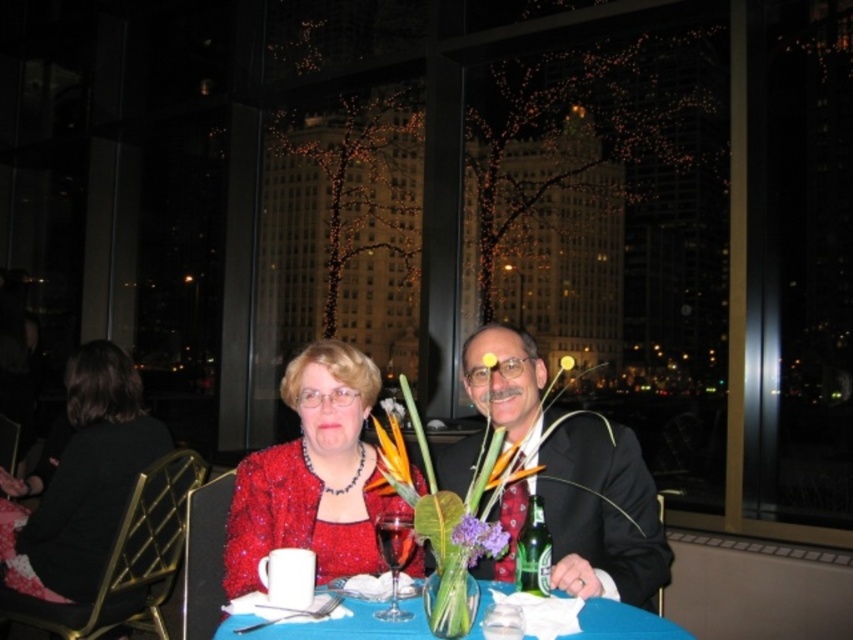
The image size is (853, 640). In order to click on transparent glass wine glass at center in this screenshot , I will do `click(393, 556)`.

Is transparent glass wine glass at center further to the viewer compared to purple matte flower at center?

Yes.

This screenshot has width=853, height=640. What are the coordinates of `transparent glass wine glass at center` in the screenshot? It's located at (393, 556).

Identify the location of transparent glass wine glass at center. (393, 556).

Who is positioned more to the left, blue fabric table at center or transparent glass wine glass at center?

transparent glass wine glass at center

Which of these two, blue fabric table at center or transparent glass wine glass at center, stands shorter?

blue fabric table at center

Is point (277, 627) behind point (399, 540)?

No, it is in front of (399, 540).

At what (x,y) coordinates should I click in order to perform the action: click on blue fabric table at center. Please return your answer as a coordinate pair (x, y). Looking at the image, I should click on (337, 625).

Which is more to the right, blue fabric table at center or green leafy stem at center?

green leafy stem at center

Can you confirm if blue fabric table at center is positioned below green leafy stem at center?

Indeed, blue fabric table at center is positioned under green leafy stem at center.

Find the location of a particular element. This screenshot has height=640, width=853. blue fabric table at center is located at coordinates 337,625.

Find the location of a particular element. The width and height of the screenshot is (853, 640). blue fabric table at center is located at coordinates (337, 625).